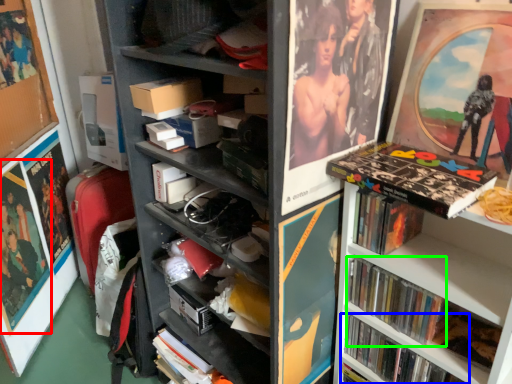
Question: Based on their relative distances, which object is farther from poster page (highlighted by a red box)? Choose from book (highlighted by a blue box) and book (highlighted by a green box).

Choices:
 (A) book
 (B) book

Answer: (B)